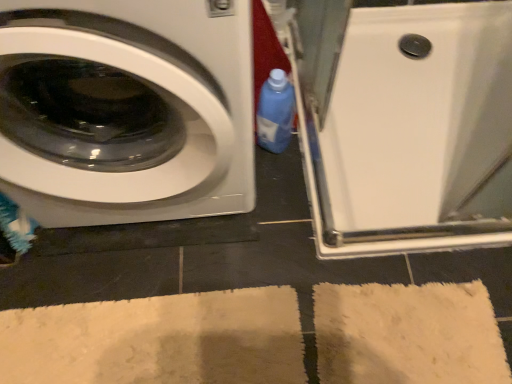
Question: Considering the relative sizes of white glossy washing machine at left and blue plastic bottle at center in the image provided, is white glossy washing machine at left smaller than blue plastic bottle at center?

Choices:
 (A) yes
 (B) no

Answer: (B)

Question: Can you confirm if white glossy washing machine at left is bigger than blue plastic bottle at center?

Choices:
 (A) yes
 (B) no

Answer: (A)

Question: Considering the relative positions of white glossy washing machine at left and blue plastic bottle at center in the image provided, is white glossy washing machine at left to the right of blue plastic bottle at center from the viewer's perspective?

Choices:
 (A) yes
 (B) no

Answer: (B)

Question: Would you say white glossy washing machine at left is outside blue plastic bottle at center?

Choices:
 (A) yes
 (B) no

Answer: (A)

Question: Considering the relative sizes of white glossy washing machine at left and blue plastic bottle at center in the image provided, is white glossy washing machine at left thinner than blue plastic bottle at center?

Choices:
 (A) no
 (B) yes

Answer: (A)

Question: From a real-world perspective, does white glossy washing machine at left sit lower than blue plastic bottle at center?

Choices:
 (A) no
 (B) yes

Answer: (A)

Question: Can you confirm if blue plastic bottle at center is shorter than white glossy shower tray at upper right?

Choices:
 (A) no
 (B) yes

Answer: (A)

Question: Is blue plastic bottle at center further to camera compared to white glossy shower tray at upper right?

Choices:
 (A) no
 (B) yes

Answer: (A)

Question: Can you confirm if blue plastic bottle at center is positioned to the left of white glossy shower tray at upper right?

Choices:
 (A) yes
 (B) no

Answer: (A)

Question: From the image's perspective, is blue plastic bottle at center below white glossy shower tray at upper right?

Choices:
 (A) yes
 (B) no

Answer: (A)

Question: From the image's perspective, is blue plastic bottle at center on top of white glossy shower tray at upper right?

Choices:
 (A) yes
 (B) no

Answer: (B)

Question: Can you confirm if blue plastic bottle at center is smaller than white glossy shower tray at upper right?

Choices:
 (A) yes
 (B) no

Answer: (A)

Question: Would you say white glossy shower tray at upper right is a long distance from blue plastic bottle at center?

Choices:
 (A) no
 (B) yes

Answer: (A)